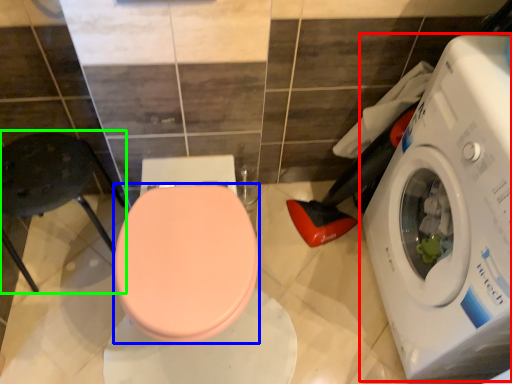
Question: Which object is positioned closest to washing machine (highlighted by a red box)? Select from bidet (highlighted by a blue box) and chair (highlighted by a green box).

Choices:
 (A) bidet
 (B) chair

Answer: (A)